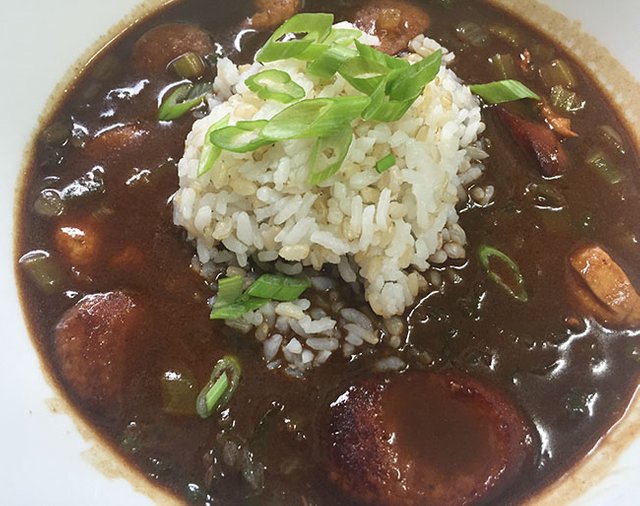
Image resolution: width=640 pixels, height=506 pixels. In order to click on white table in this screenshot , I will do `click(38, 28)`.